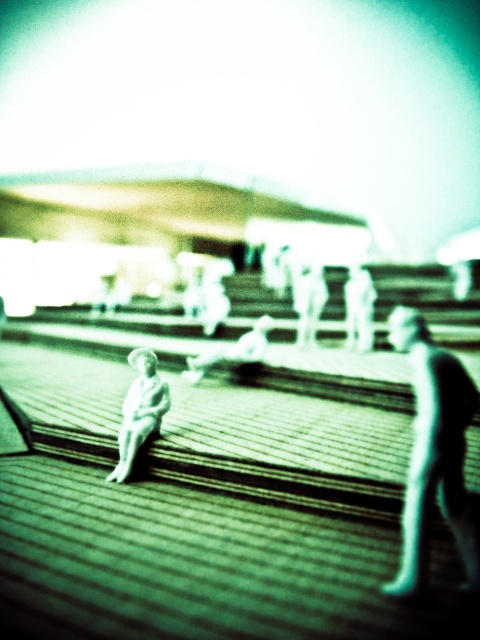
You are standing at the center of the scene and want to place a new object between the smooth black figure at right and the white glossy statue at lower left. Based on their positions, where should you place the new object?

The smooth black figure at right is located above the white glossy statue at lower left, so you should place the new object between them in the lower middle area between the two objects.

You are standing at the point with coordinates point (152, 422) and want to walk towards the figurine. Is the point point (423, 445) between you and the figurine?

Yes, the point (423, 445) is between you and the figurine because it is in front of point (152, 422) where you are standing.